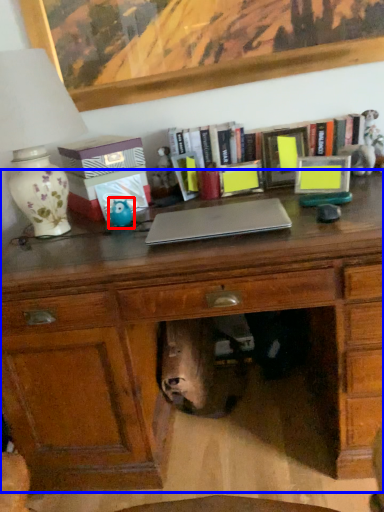
Question: Among these objects, which one is farthest to the camera, toy (highlighted by a red box) or desk (highlighted by a blue box)?

Choices:
 (A) toy
 (B) desk

Answer: (A)